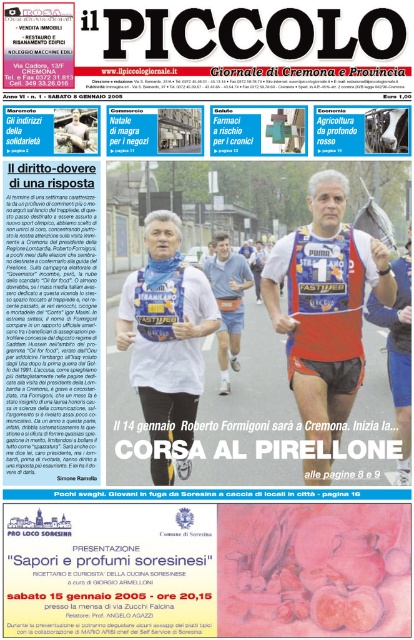
You are a graphic designer who wants to place a new advertisement on the front page of the newspaper. The advertisement must be placed to the right of the blue fabric runner at center. Where should you place the advertisement?

The advertisement should be placed to the right of the blue fabric runner at center, which is located at point (324, 314) in 2D coordinates.

You are a tailor who needs to adjust the blue fabric runner at center and the white fabric vest at center. The minimum distance required between them for comfortable adjustment is 4 feet. Can you work on both items comfortably?

The distance between the blue fabric runner at center and the white fabric vest at center is 3.86 feet, which is slightly less than the required 4 feet. Therefore, you may not have enough space to work on both items comfortably.